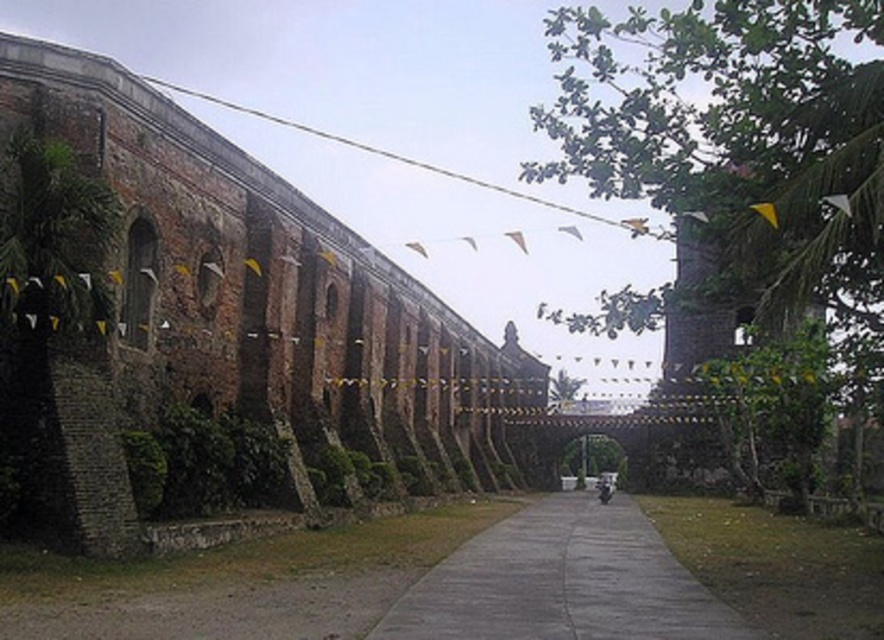
Can you confirm if green leafy tree at center is smaller than silver metallic motorcycle at center?

Yes.

This screenshot has height=640, width=884. Describe the element at coordinates (562, 388) in the screenshot. I see `green leafy tree at center` at that location.

Find the location of a particular element. green leafy tree at center is located at coordinates (562, 388).

Find the location of a particular element. green leafy tree at center is located at coordinates (562, 388).

Is brown brick wall at left closer to camera compared to silver metallic motorcycle at center?

Yes, it is.

Is brown brick wall at left thinner than silver metallic motorcycle at center?

In fact, brown brick wall at left might be wider than silver metallic motorcycle at center.

Which is in front, point (164, 326) or point (601, 497)?

Point (164, 326) is in front.

Locate an element on the screen. Image resolution: width=884 pixels, height=640 pixels. brown brick wall at left is located at coordinates (225, 326).

Can you confirm if gray concrete pavement at center is positioned above brick wall at upper left?

Actually, gray concrete pavement at center is below brick wall at upper left.

Does gray concrete pavement at center appear under brick wall at upper left?

Yes, gray concrete pavement at center is below brick wall at upper left.

Image resolution: width=884 pixels, height=640 pixels. What do you see at coordinates (562, 582) in the screenshot?
I see `gray concrete pavement at center` at bounding box center [562, 582].

You are a GUI agent. You are given a task and a screenshot of the screen. Output one action in this format:
    pyautogui.click(x=<x>, y=<y>)
    Task: Click on the gray concrete pavement at center
    
    Given the screenshot: What is the action you would take?
    pyautogui.click(x=562, y=582)